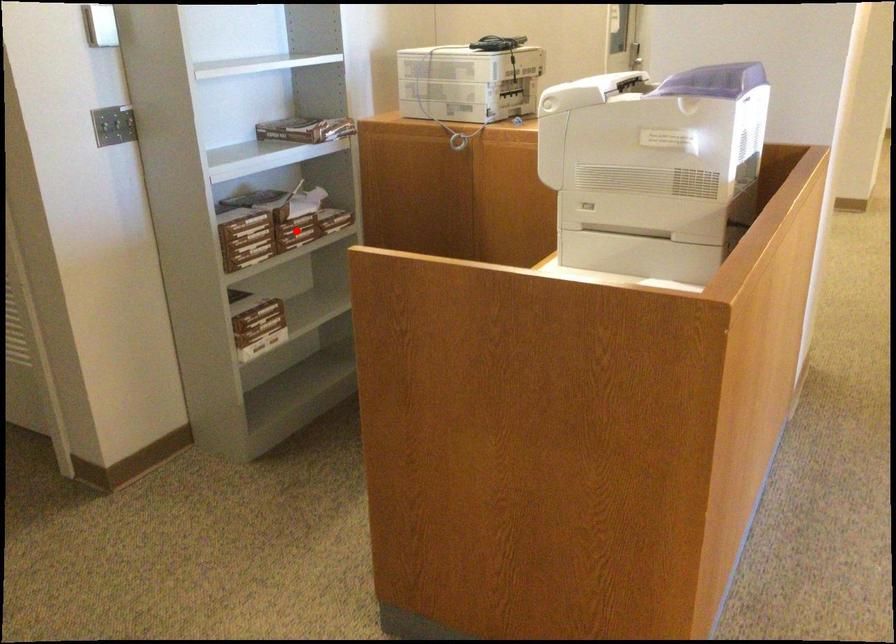
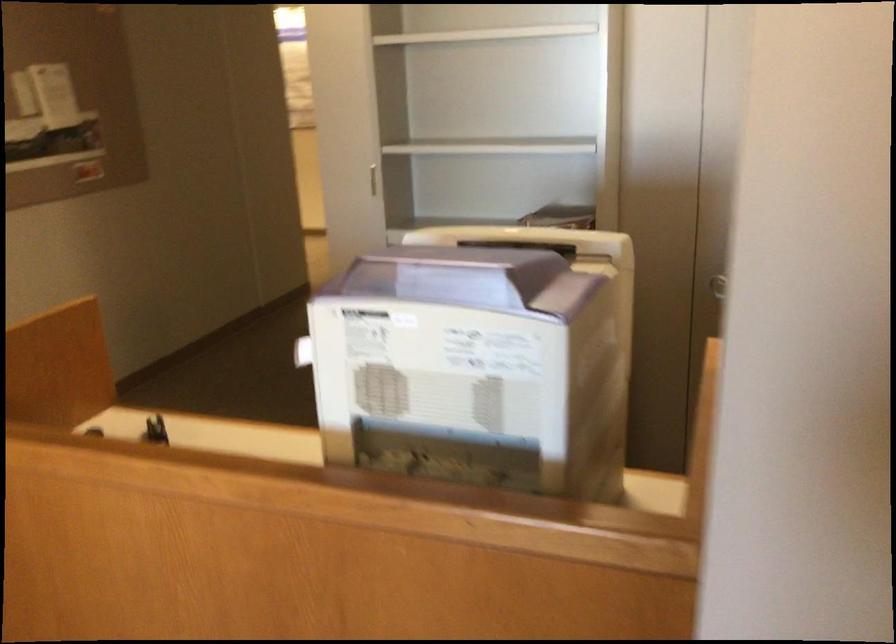
Question: I am providing you with two images of the same scene from different viewpoints. A red point is marked on the first image. Is the red point's position out of view in image 2?

Choices:
 (A) Yes
 (B) No

Answer: (A)